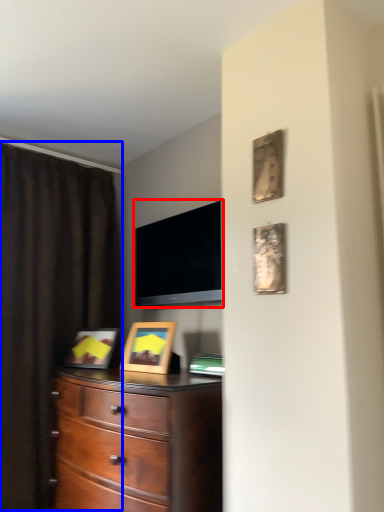
Question: Among these objects, which one is farthest to the camera, television (highlighted by a red box) or curtain (highlighted by a blue box)?

Choices:
 (A) television
 (B) curtain

Answer: (A)